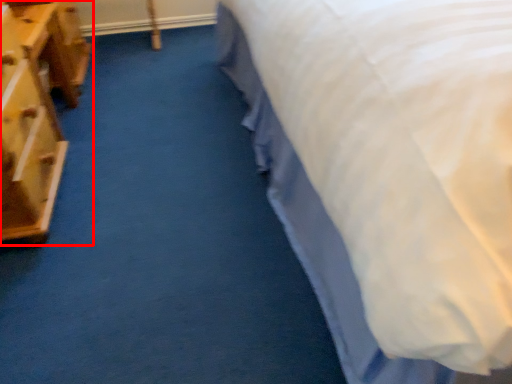
Question: From the image's perspective, where is furniture (annotated by the red box) located relative to bed?

Choices:
 (A) below
 (B) above

Answer: (B)